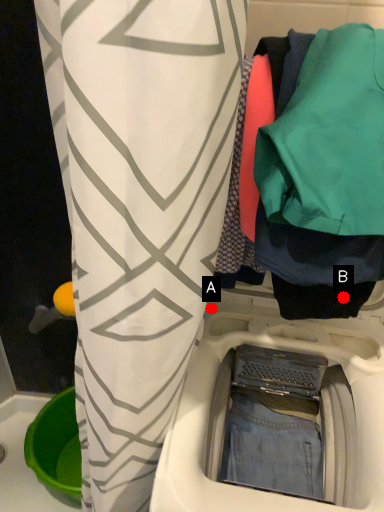
Question: Two points are circled on the image, labeled by A and B beside each circle. Which point is farther to the camera?

Choices:
 (A) A is further
 (B) B is further

Answer: (A)